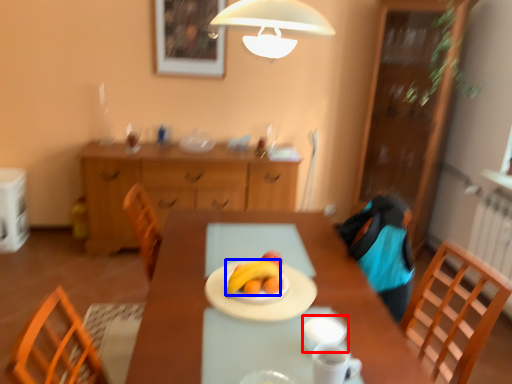
Question: Among these objects, which one is farthest to the camera, tableware (highlighted by a red box) or banana (highlighted by a blue box)?

Choices:
 (A) tableware
 (B) banana

Answer: (B)